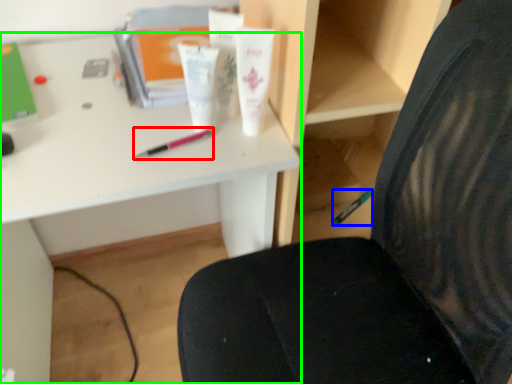
Question: Which object is the farthest from pencil (highlighted by a red box)? Choose among these: stationery (highlighted by a blue box) or desk (highlighted by a green box).

Choices:
 (A) stationery
 (B) desk

Answer: (A)